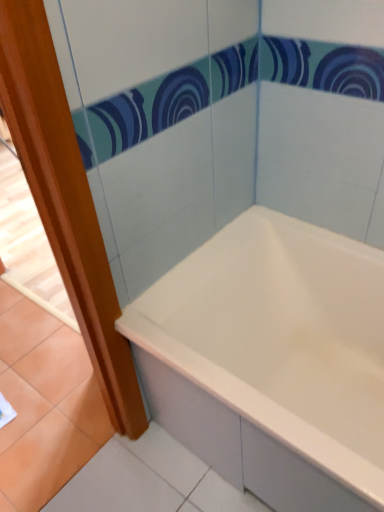
The image size is (384, 512). What do you see at coordinates (272, 361) in the screenshot?
I see `white glossy bathtub at center` at bounding box center [272, 361].

The height and width of the screenshot is (512, 384). What are the coordinates of `white glossy bathtub at center` in the screenshot? It's located at (272, 361).

The image size is (384, 512). Identify the location of white glossy bathtub at center. (272, 361).